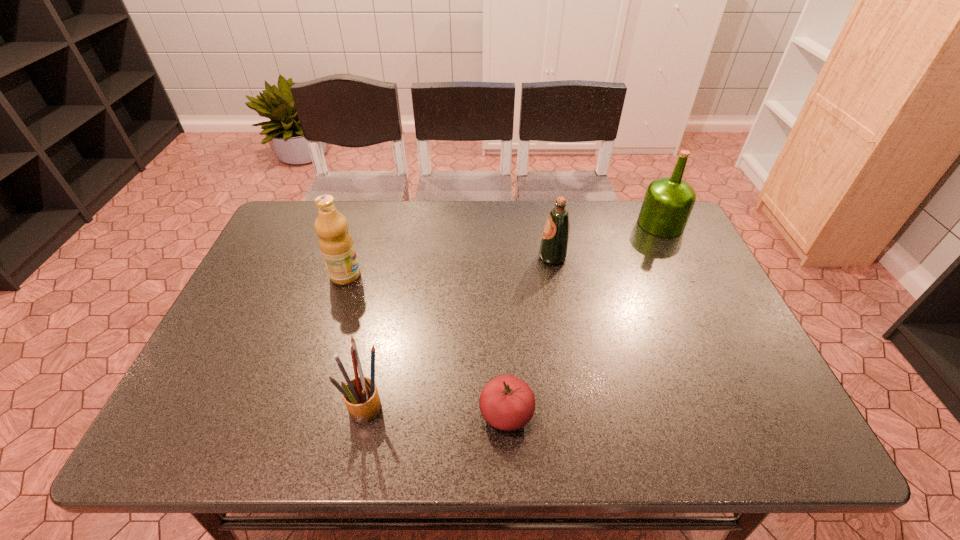
At what (x,y) coordinates should I click in order to perform the action: click on vacant area situated 0.270m on the front of the farthest olive oil. Please return your answer as a coordinate pair (x, y). The width and height of the screenshot is (960, 540). Looking at the image, I should click on (699, 302).

Find the location of a particular element. Image resolution: width=960 pixels, height=540 pixels. free space located 0.220m on the front-facing side of the second object from right to left is located at coordinates (464, 257).

What are the coordinates of `vacant space located on the front-facing side of the second object from right to left` in the screenshot? It's located at (450, 257).

You are a GUI agent. You are given a task and a screenshot of the screen. Output one action in this format:
    pyautogui.click(x=<x>, y=<y>)
    Task: Click on the vacant space located 0.140m on the front-facing side of the second object from right to left
    Image resolution: width=960 pixels, height=540 pixels.
    Given the screenshot: What is the action you would take?
    coord(492,257)

Image resolution: width=960 pixels, height=540 pixels. What are the coordinates of `vacant point located 0.060m on the back of the pencil box` in the screenshot? It's located at (374, 361).

Locate an element on the screen. This screenshot has height=540, width=960. free point located 0.400m on the left of the tomato is located at coordinates [292, 414].

What are the coordinates of `object that is at the far edge` in the screenshot? It's located at (x=668, y=201).

What are the coordinates of `pencil box that is at the near edge` in the screenshot? It's located at (361, 397).

In order to click on tomato located at the near edge in this screenshot , I will do `click(507, 403)`.

Locate an element on the screen. The width and height of the screenshot is (960, 540). object that is positioned at the right edge is located at coordinates (668, 201).